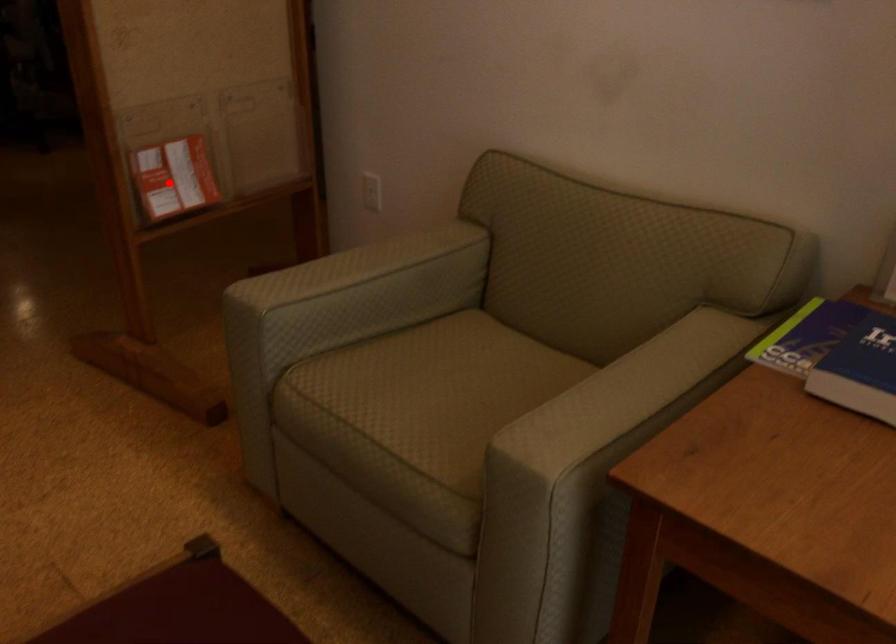
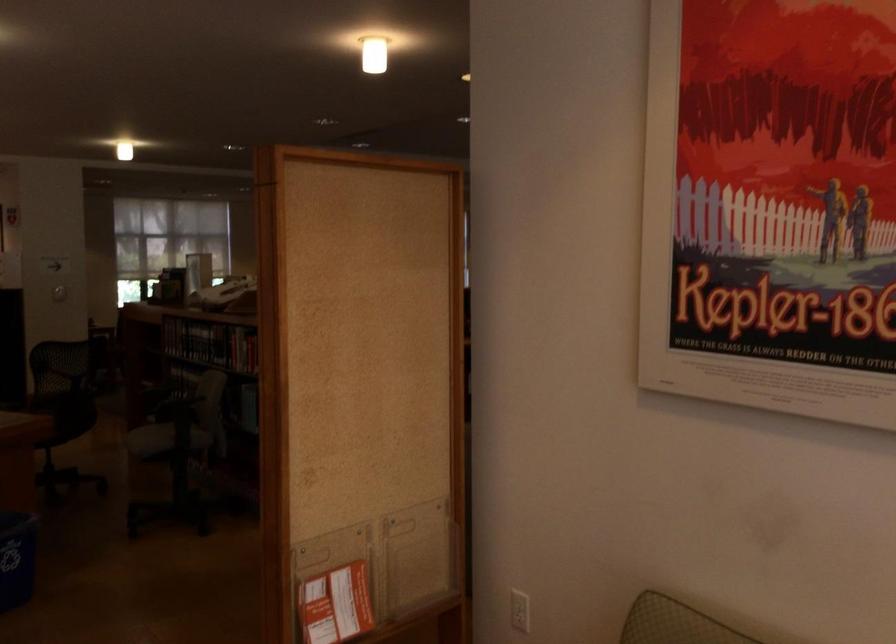
The point at the highlighted location is marked in the first image. Where is the corresponding point in the second image?

(336, 605)